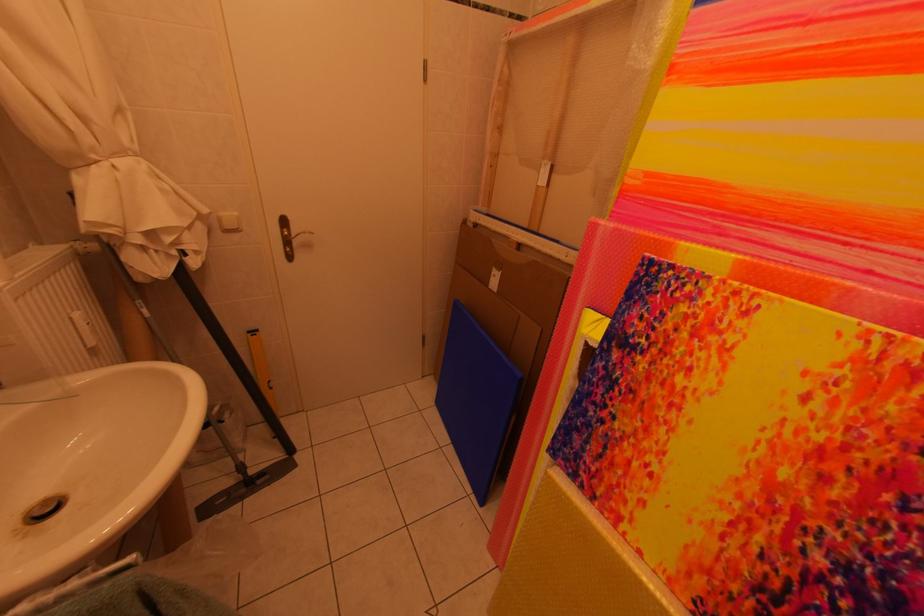
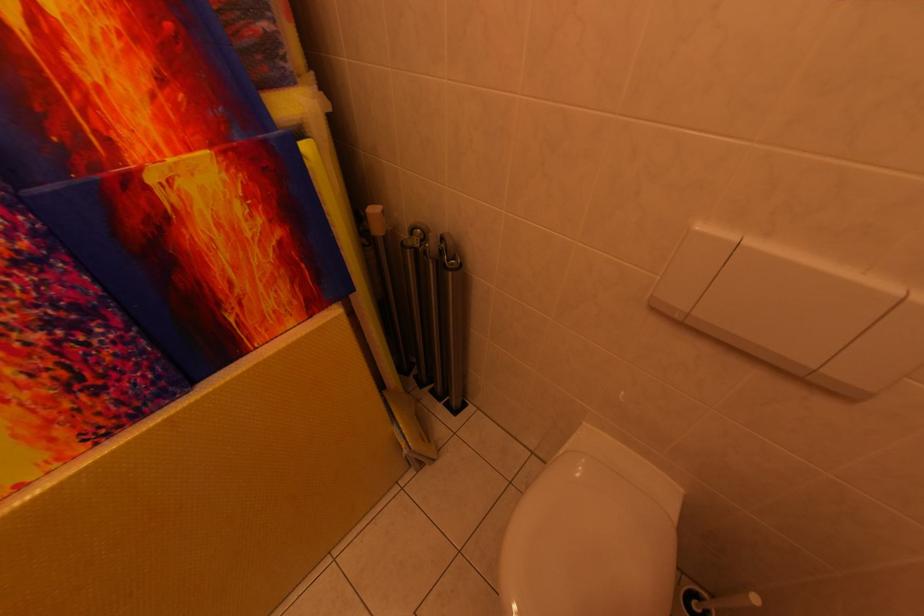
The first image is from the beginning of the video and the second image is from the end. How did the camera likely rotate when shooting the video?

The camera's rotation is toward right-down.